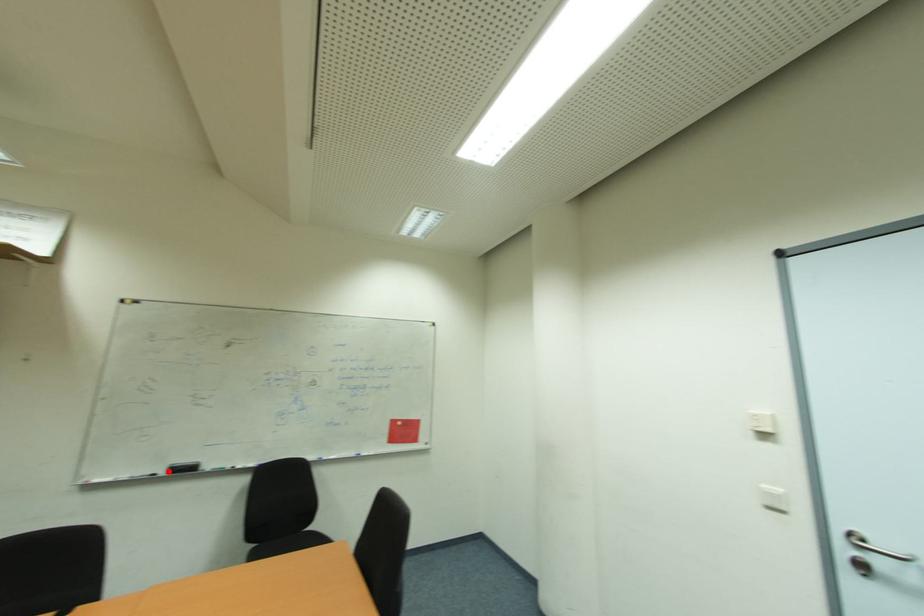
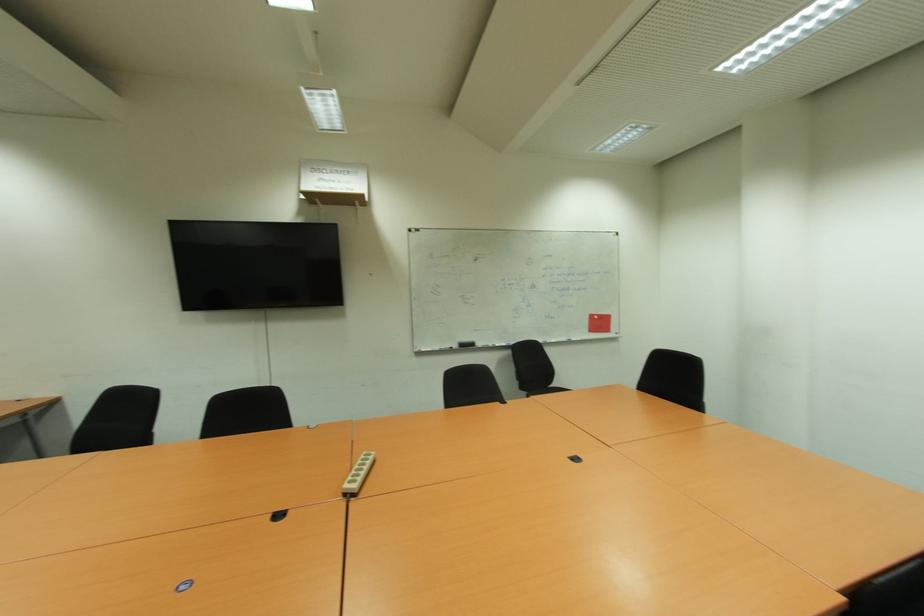
Find the pixel in the second image that matches the highlighted location in the first image.

(457, 347)